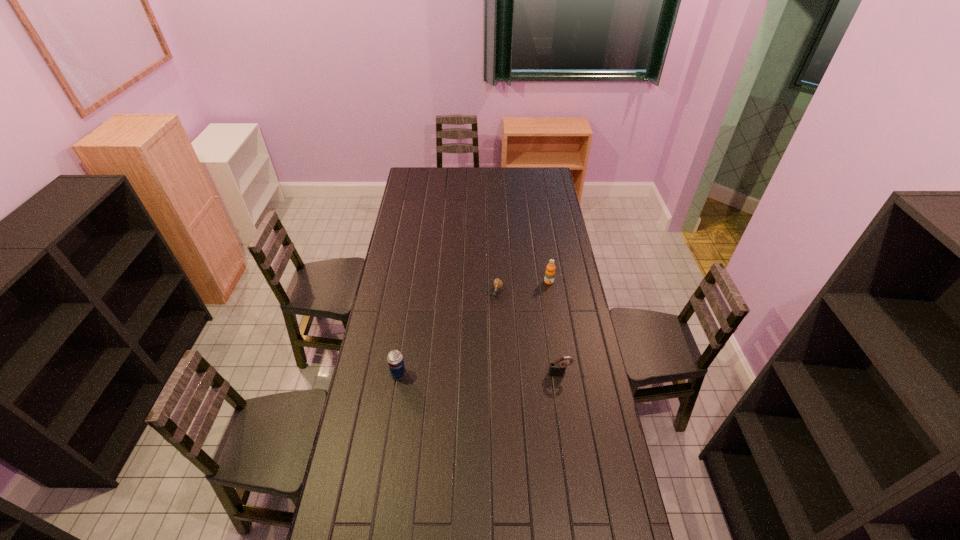
Where is `vacant position located on the front-facing side of the shortest object`? Image resolution: width=960 pixels, height=540 pixels. vacant position located on the front-facing side of the shortest object is located at coordinates (484, 332).

Locate an element on the screen. This screenshot has width=960, height=540. free region located 0.230m on the front-facing side of the shortest object is located at coordinates (481, 339).

Locate an element on the screen. The height and width of the screenshot is (540, 960). free space located 0.150m on the front-facing side of the shortest object is located at coordinates (487, 325).

Image resolution: width=960 pixels, height=540 pixels. I want to click on object that is at the left edge, so click(x=395, y=360).

Where is `padlock that is at the right edge`? padlock that is at the right edge is located at coordinates (557, 368).

At what (x,y) coordinates should I click in order to perform the action: click on orange juice that is at the right edge. Please return your answer as a coordinate pair (x, y). This screenshot has width=960, height=540. Looking at the image, I should click on (550, 268).

You are a GUI agent. You are given a task and a screenshot of the screen. Output one action in this format:
    pyautogui.click(x=<x>, y=<y>)
    Task: Click on the vacant region at the far edge of the desktop
    
    Given the screenshot: What is the action you would take?
    pyautogui.click(x=479, y=174)

Locate an element on the screen. The image size is (960, 540). free space at the left edge is located at coordinates (x=402, y=227).

Locate an element on the screen. This screenshot has width=960, height=540. vacant space at the right edge of the desktop is located at coordinates (558, 228).

This screenshot has height=540, width=960. In order to click on vacant area at the far right corner of the desktop in this screenshot , I will do `click(542, 184)`.